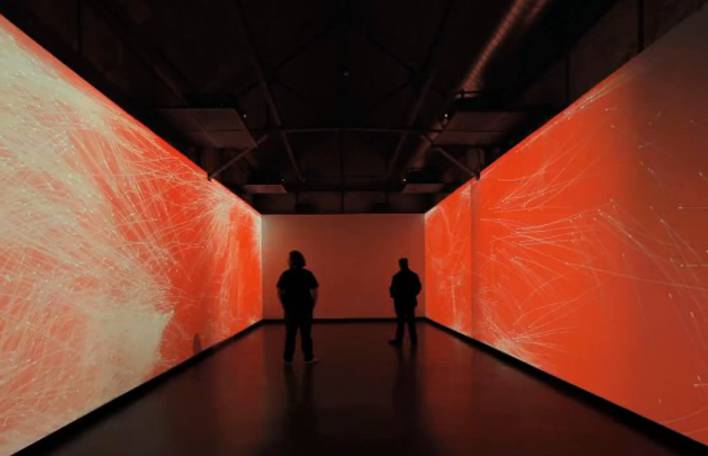
Find the location of a particular element. This screenshot has width=708, height=456. orange walls is located at coordinates (595, 359), (355, 268), (211, 279).